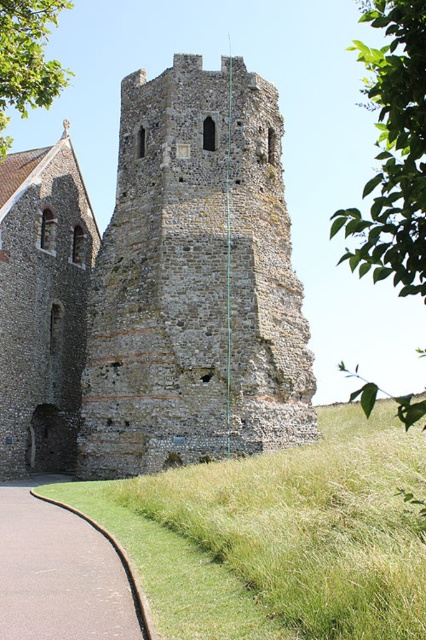
Can you confirm if gray stone tower at center is positioned to the left of asphalt road at lower left?

Indeed, gray stone tower at center is positioned on the left side of asphalt road at lower left.

Is gray stone tower at center thinner than asphalt road at lower left?

No, gray stone tower at center is not thinner than asphalt road at lower left.

Is point (81, 282) positioned before point (78, 618)?

No, (81, 282) is behind (78, 618).

Where is `gray stone tower at center`? Image resolution: width=426 pixels, height=640 pixels. gray stone tower at center is located at coordinates (155, 289).